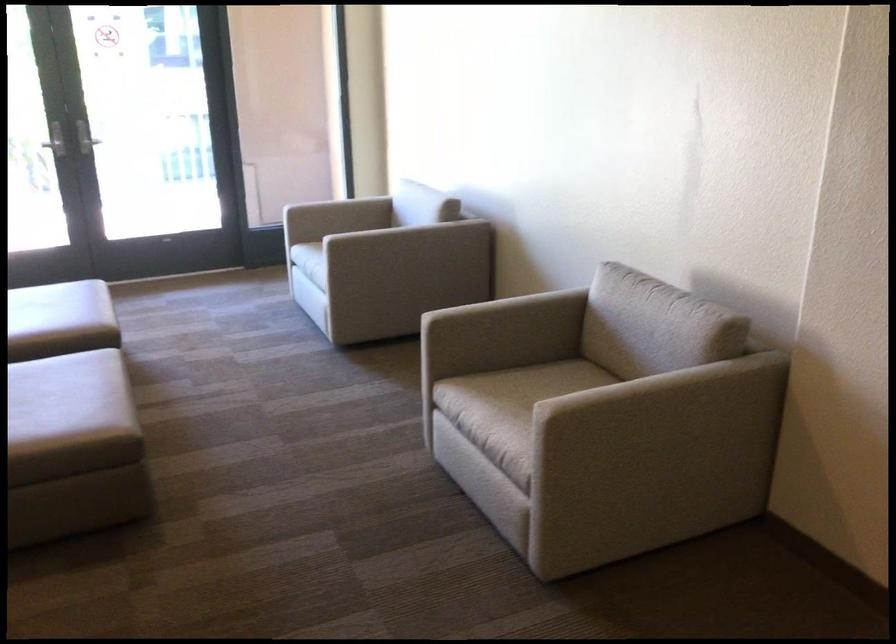
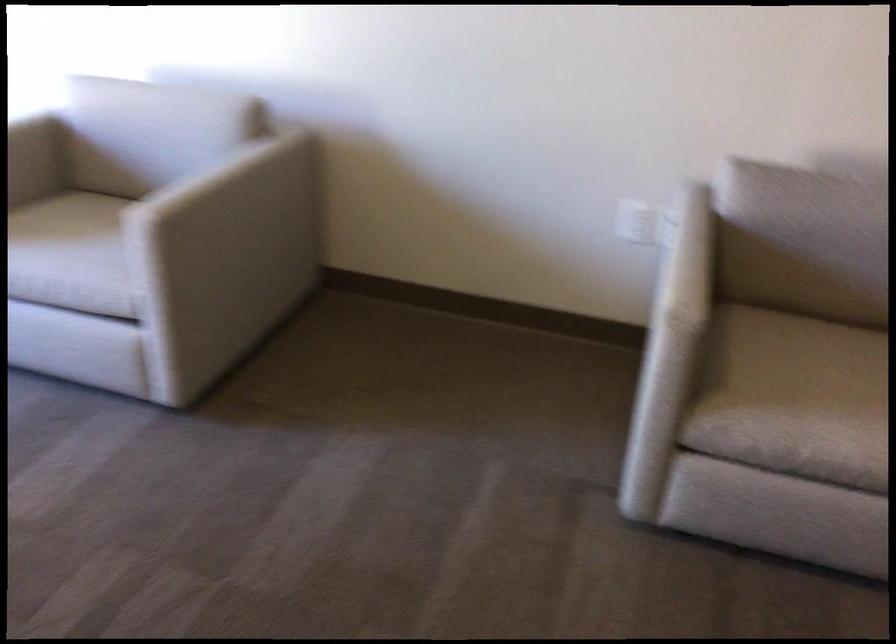
Locate, in the second image, the point that corresponds to (x=513, y=304) in the first image.

(702, 252)